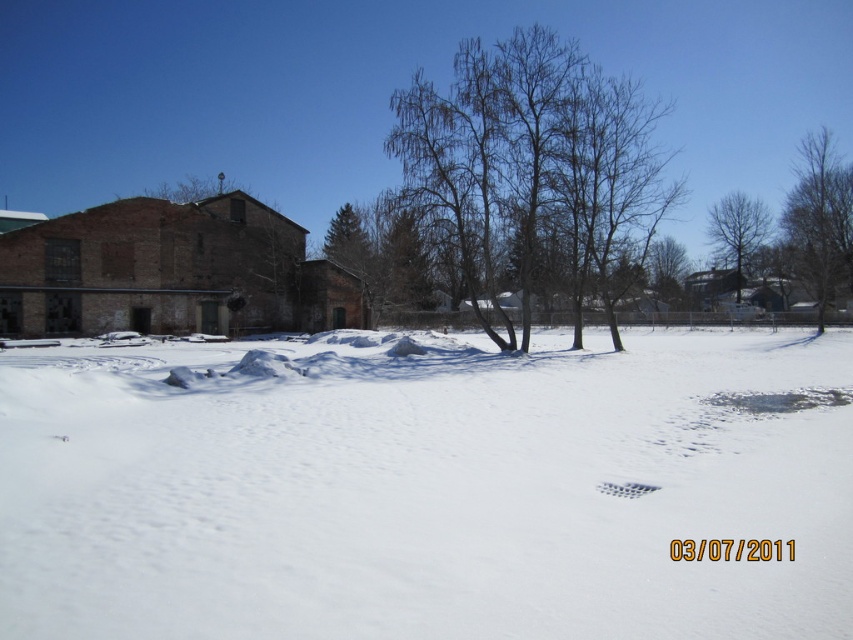
Between white powdery snow at center and white plastic footprint at center, which one is positioned higher?

Positioned higher is white powdery snow at center.

Which is in front, point (712, 372) or point (608, 490)?

Point (608, 490) is more forward.

Locate an element on the screen. The height and width of the screenshot is (640, 853). white powdery snow at center is located at coordinates (424, 490).

At what (x,y) coordinates should I click in order to perform the action: click on white powdery snow at center. Please return your answer as a coordinate pair (x, y). This screenshot has height=640, width=853. Looking at the image, I should click on (424, 490).

Can you confirm if bare branches at upper right is positioned below white plastic footprint at center?

No.

Who is positioned more to the right, bare branches at upper right or white plastic footprint at center?

From the viewer's perspective, bare branches at upper right appears more on the right side.

Which is behind, point (813, 227) or point (622, 496)?

Point (813, 227)

Locate an element on the screen. Image resolution: width=853 pixels, height=640 pixels. bare branches at upper right is located at coordinates (819, 220).

Can you confirm if white powdery snow at center is positioned to the right of bare branches at center?

No, white powdery snow at center is not to the right of bare branches at center.

Can you confirm if white powdery snow at center is bigger than bare branches at center?

No.

The height and width of the screenshot is (640, 853). Find the location of `white powdery snow at center`. white powdery snow at center is located at coordinates [424, 490].